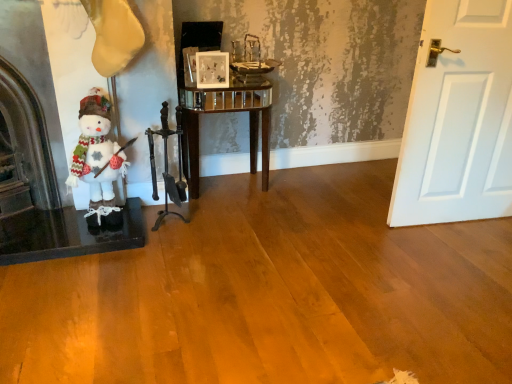
You are a GUI agent. You are given a task and a screenshot of the screen. Output one action in this format:
    pyautogui.click(x=<x>, y=<y>)
    Task: Click on the matte glass picture frame at center
    This screenshot has width=512, height=384.
    Given the screenshot: What is the action you would take?
    pyautogui.click(x=212, y=69)

The image size is (512, 384). In order to click on white fabric snowman at left in this screenshot , I will do `click(97, 160)`.

Describe the element at coordinates (225, 112) in the screenshot. I see `glossy wood side table at center` at that location.

The width and height of the screenshot is (512, 384). Find the location of `dark brown polished wood fireplace tools at center`. dark brown polished wood fireplace tools at center is located at coordinates (167, 169).

Find the location of a particular element. The image size is (512, 384). dark brown stone fireplace at left is located at coordinates (28, 168).

Looking at the image, does glossy wood side table at center seem bigger or smaller compared to matte glass picture frame at center?

Clearly, glossy wood side table at center is larger in size than matte glass picture frame at center.

Between glossy wood side table at center and matte glass picture frame at center, which one has smaller width?

Thinner between the two is matte glass picture frame at center.

You are a GUI agent. You are given a task and a screenshot of the screen. Output one action in this format:
    pyautogui.click(x=<x>, y=<y>)
    Task: Click on the picture frame that is on the left side of glossy wood side table at center
    
    Given the screenshot: What is the action you would take?
    (212, 69)

Is glossy wood side table at center turned away from matte glass picture frame at center?

No, glossy wood side table at center is not facing the opposite direction of matte glass picture frame at center.

Considering the relative sizes of white fabric snowman at left and dark brown stone fireplace at left in the image provided, is white fabric snowman at left smaller than dark brown stone fireplace at left?

Yes.

Which is in front, white fabric snowman at left or dark brown stone fireplace at left?

dark brown stone fireplace at left is in front.

Is white fabric snowman at left at the right side of dark brown stone fireplace at left?

Indeed, white fabric snowman at left is positioned on the right side of dark brown stone fireplace at left.

Is white fabric snowman at left looking in the opposite direction of dark brown stone fireplace at left?

No, white fabric snowman at left's orientation is not away from dark brown stone fireplace at left.

Are glossy wood side table at center and white fabric snowman at left located far from each other?

Actually, glossy wood side table at center and white fabric snowman at left are a little close together.

Which of these two, glossy wood side table at center or white fabric snowman at left, is thinner?

With smaller width is white fabric snowman at left.

Based on the photo, is glossy wood side table at center taller than white fabric snowman at left?

Correct, glossy wood side table at center is much taller as white fabric snowman at left.

Considering the relative positions of glossy wood side table at center and white fabric snowman at left in the image provided, is glossy wood side table at center to the right of white fabric snowman at left from the viewer's perspective?

Yes.

Can you confirm if dark brown polished wood fireplace tools at center is thinner than dark brown stone fireplace at left?

Yes.

Considering the positions of points (183, 193) and (24, 173), is point (183, 193) closer to camera compared to point (24, 173)?

No.

Looking at this image, which object is further away from the camera, dark brown polished wood fireplace tools at center or dark brown stone fireplace at left?

Positioned behind is dark brown polished wood fireplace tools at center.

Could you tell me if dark brown polished wood fireplace tools at center is turned towards dark brown stone fireplace at left?

No, dark brown polished wood fireplace tools at center is not facing towards dark brown stone fireplace at left.

How many degrees apart are the facing directions of dark brown polished wood fireplace tools at center and matte glass picture frame at center?

1.45 degrees.

From the image's perspective, would you say dark brown polished wood fireplace tools at center is shown under matte glass picture frame at center?

Yes, from the image's perspective, dark brown polished wood fireplace tools at center is beneath matte glass picture frame at center.

In terms of height, does dark brown polished wood fireplace tools at center look taller or shorter compared to matte glass picture frame at center?

Clearly, dark brown polished wood fireplace tools at center is taller compared to matte glass picture frame at center.

Considering the sizes of objects dark brown polished wood fireplace tools at center and matte glass picture frame at center in the image provided, who is bigger, dark brown polished wood fireplace tools at center or matte glass picture frame at center?

Bigger between the two is dark brown polished wood fireplace tools at center.

Considering the relative sizes of dark brown stone fireplace at left and dark brown polished wood fireplace tools at center in the image provided, is dark brown stone fireplace at left wider than dark brown polished wood fireplace tools at center?

Yes.

In the scene shown: From a real-world perspective, which object stands above the other?

dark brown stone fireplace at left, from a real-world perspective.

Can you confirm if dark brown stone fireplace at left is shorter than dark brown polished wood fireplace tools at center?

No, dark brown stone fireplace at left is not shorter than dark brown polished wood fireplace tools at center.

Is dark brown stone fireplace at left far from white fabric snowman at left?

No, dark brown stone fireplace at left is not far away from white fabric snowman at left.

Does dark brown stone fireplace at left have a greater height compared to white fabric snowman at left?

Indeed, dark brown stone fireplace at left has a greater height compared to white fabric snowman at left.

Is point (24, 154) closer to camera compared to point (94, 174)?

No, (24, 154) is behind (94, 174).

Can you tell me how much dark brown stone fireplace at left and white fabric snowman at left differ in facing direction?

The facing directions of dark brown stone fireplace at left and white fabric snowman at left are 0.000794 degrees apart.

The image size is (512, 384). What are the coordinates of `picture frame that appears on the left of glossy wood side table at center` in the screenshot? It's located at (212, 69).

Identify the location of fireplace lying above the white fabric snowman at left (from the image's perspective). This screenshot has height=384, width=512. (28, 168).

Estimate the real-world distances between objects in this image. Which object is closer to matte glass picture frame at center, white fabric snowman at left or dark brown stone fireplace at left?

white fabric snowman at left.

Which object lies further to the anchor point dark brown polished wood fireplace tools at center, glossy wood side table at center or dark brown stone fireplace at left?

dark brown stone fireplace at left is positioned further to the anchor dark brown polished wood fireplace tools at center.

Based on their spatial positions, is dark brown stone fireplace at left or white fabric snowman at left closer to glossy wood side table at center?

Among the two, white fabric snowman at left is located nearer to glossy wood side table at center.

Estimate the real-world distances between objects in this image. Which object is closer to glossy wood side table at center, dark brown stone fireplace at left or dark brown polished wood fireplace tools at center?

The object closer to glossy wood side table at center is dark brown polished wood fireplace tools at center.

Estimate the real-world distances between objects in this image. Which object is closer to dark brown polished wood fireplace tools at center, dark brown stone fireplace at left or white fabric snowman at left?

white fabric snowman at left lies closer to dark brown polished wood fireplace tools at center than the other object.

Looking at the image, which one is located closer to matte glass picture frame at center, dark brown stone fireplace at left or dark brown polished wood fireplace tools at center?

The object closer to matte glass picture frame at center is dark brown polished wood fireplace tools at center.

Based on their spatial positions, is matte glass picture frame at center or white fabric snowman at left further from dark brown stone fireplace at left?

Among the two, matte glass picture frame at center is located further to dark brown stone fireplace at left.

Considering their positions, is dark brown stone fireplace at left positioned further to white fabric snowman at left than glossy wood side table at center?

glossy wood side table at center.

Identify the location of furniture between matte glass picture frame at center and dark brown polished wood fireplace tools at center vertically. (225, 112).

The image size is (512, 384). Find the location of `chair between dark brown stone fireplace at left and glossy wood side table at center in the horizontal direction`. chair between dark brown stone fireplace at left and glossy wood side table at center in the horizontal direction is located at coordinates (167, 169).

What are the coordinates of `picture frame between dark brown stone fireplace at left and glossy wood side table at center from left to right` in the screenshot? It's located at (212, 69).

Where is `chair between dark brown stone fireplace at left and matte glass picture frame at center`? chair between dark brown stone fireplace at left and matte glass picture frame at center is located at coordinates (167, 169).